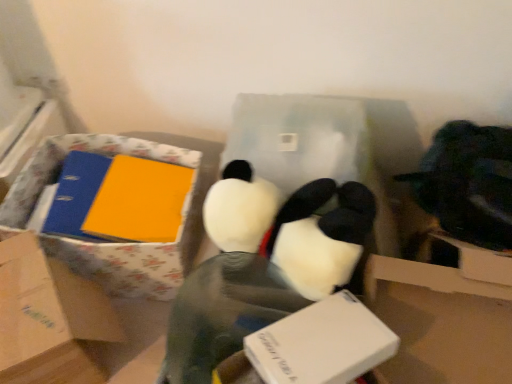
Identify the location of free space above matte yellow book at left (from a real-world perspective). This screenshot has height=384, width=512. (137, 191).